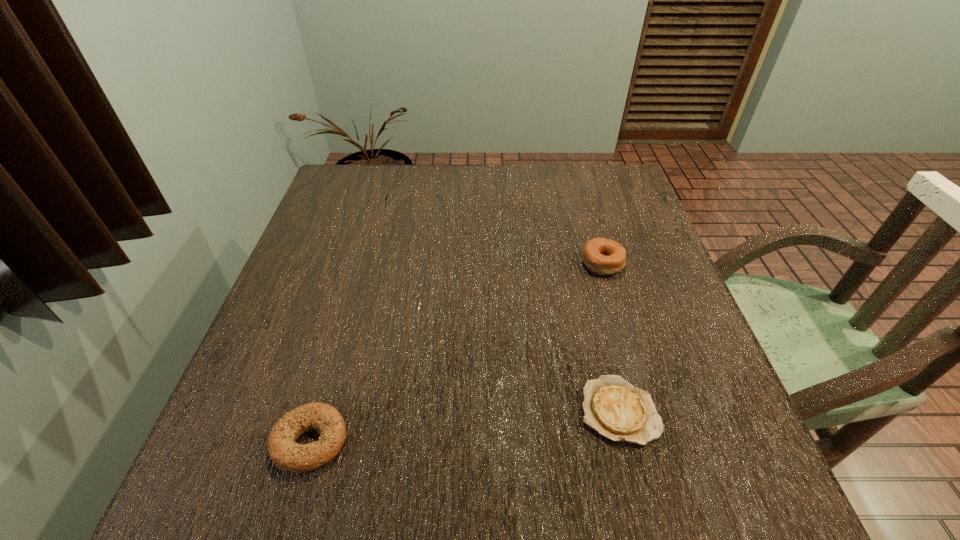
Locate an element on the screen. The width and height of the screenshot is (960, 540). vacant region at the left edge is located at coordinates (281, 343).

In the image, there is a desktop. Identify the location of vacant space at the right edge. (618, 310).

Locate an element on the screen. The height and width of the screenshot is (540, 960). vacant region at the near left corner of the desktop is located at coordinates (284, 485).

In the image, there is a desktop. Identify the location of vacant region at the far right corner. The width and height of the screenshot is (960, 540). (628, 185).

I want to click on free space at the near right corner, so pyautogui.click(x=732, y=497).

Identify the location of vacant region between the third tallest object and the right bagel. The image size is (960, 540). (456, 352).

Locate an element on the screen. blank region between the sunglasses and the quiche is located at coordinates (500, 309).

Where is `free spot between the farther bagel and the shortest object`? This screenshot has height=540, width=960. free spot between the farther bagel and the shortest object is located at coordinates (611, 337).

The image size is (960, 540). Find the location of `empty location between the farthest object and the left bagel`. empty location between the farthest object and the left bagel is located at coordinates (346, 324).

Where is `free point between the shortest object and the third nearest object`? The width and height of the screenshot is (960, 540). free point between the shortest object and the third nearest object is located at coordinates (611, 337).